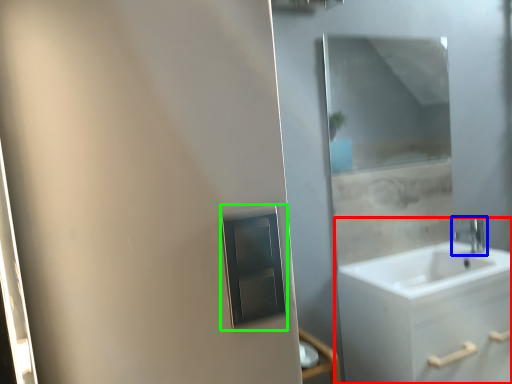
Question: Estimate the real-world distances between objects in this image. Which object is closer to bathroom cabinet (highlighted by a red box), tap (highlighted by a blue box) or medicine cabinet (highlighted by a green box)?

Choices:
 (A) tap
 (B) medicine cabinet

Answer: (A)